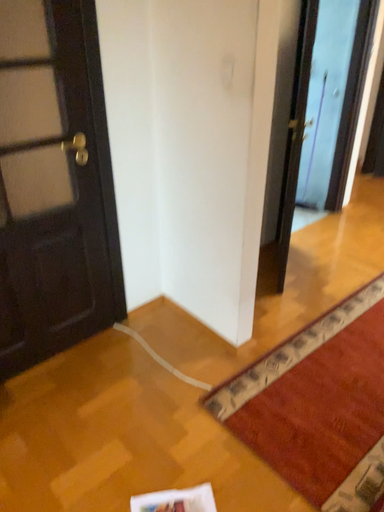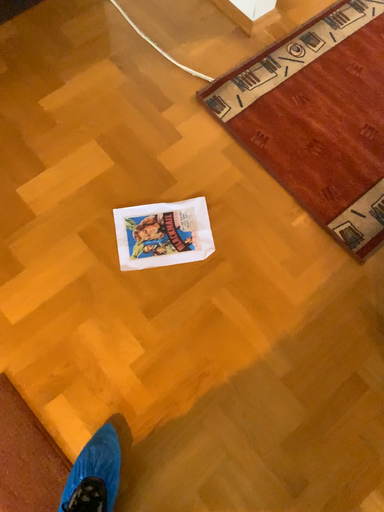
Question: Which way did the camera rotate in the video?

Choices:
 (A) rotated upward
 (B) rotated downward

Answer: (B)